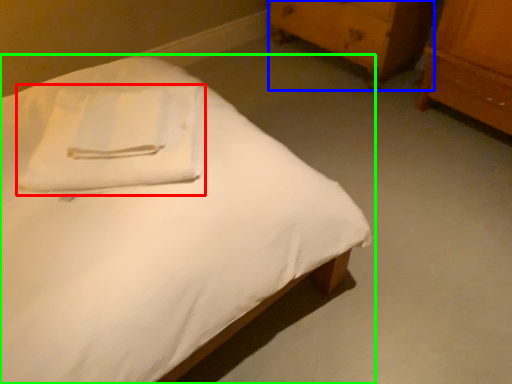
Question: Considering the real-world distances, which object is closest to cloth (highlighted by a red box)? chest of drawers (highlighted by a blue box) or bed (highlighted by a green box).

Choices:
 (A) chest of drawers
 (B) bed

Answer: (B)